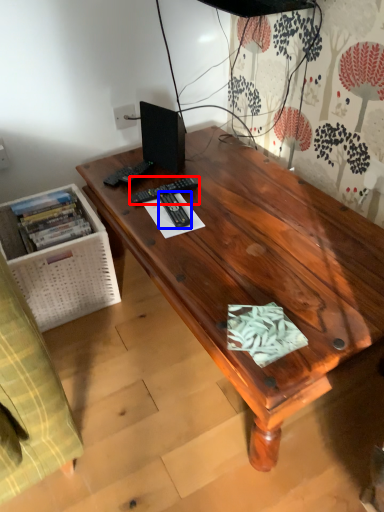
Question: Which object is closer to the camera taking this photo, remote control (highlighted by a red box) or remote control (highlighted by a blue box)?

Choices:
 (A) remote control
 (B) remote control

Answer: (B)